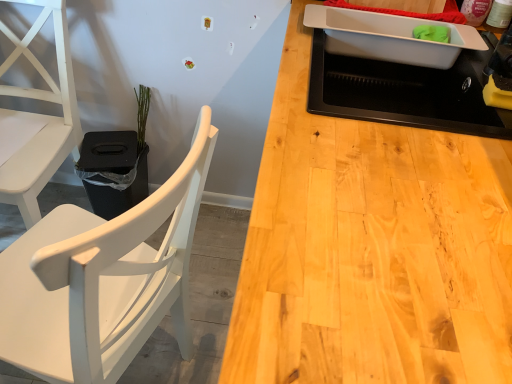
Question: In the image, is black plastic houseplant at left positioned in front of or behind white matte wood chair at left, marked as the 2th chair in a left-to-right arrangement?

Choices:
 (A) front
 (B) behind

Answer: (B)

Question: Is black plastic houseplant at left taller or shorter than white matte wood chair at left, the first chair when ordered from right to left?

Choices:
 (A) tall
 (B) short

Answer: (B)

Question: Estimate the real-world distances between objects in this image. Which object is closer to the black plastic houseplant at left?

Choices:
 (A) green matte plant at upper left
 (B) white plastic tray at upper right
 (C) black matte sink at upper right
 (D) white matte chair at left, which ranks as the 2th chair in right-to-left order
 (E) white matte wood chair at left, the first chair when ordered from right to left

Answer: (A)

Question: Which of these objects is positioned farthest from the white matte wood chair at left, marked as the 2th chair in a left-to-right arrangement?

Choices:
 (A) black plastic houseplant at left
 (B) white plastic tray at upper right
 (C) green matte plant at upper left
 (D) black matte sink at upper right
 (E) white matte chair at left, which ranks as the 2th chair in right-to-left order

Answer: (C)